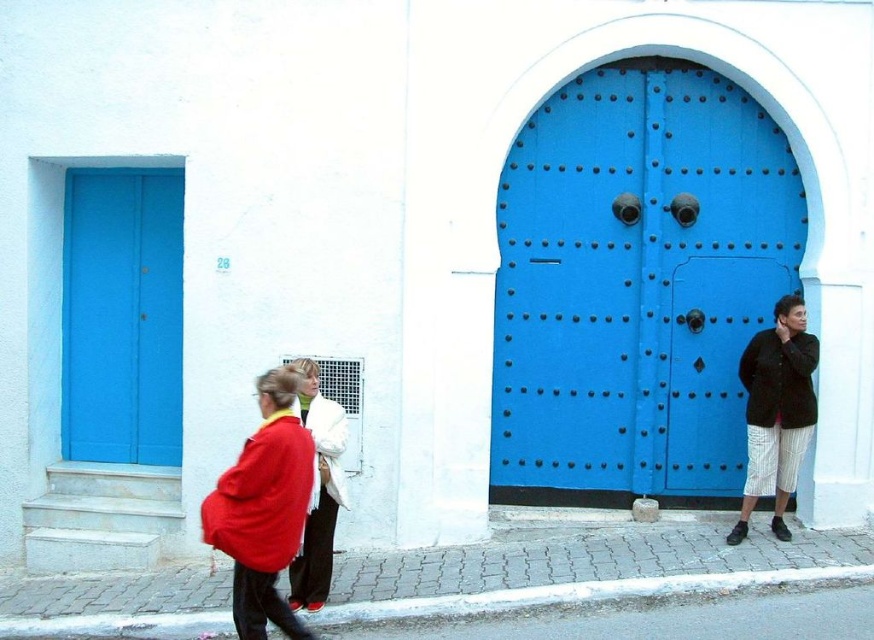
You are a delivery person trying to find apartment number 28. You see the blue painted wood door at center and the matte red sweatshirt at lower left. Which object should you approach first to locate apartment 28?

The blue painted wood door at center should be approached first because the matte red sweatshirt at lower left is behind it, so the door is closer to you.

You are a delivery person trying to distinguish between two customers waiting at the right side of the street. You see the black textured jacket at right and the dark brown cotton sweatshirt at right. Which customer is wearing the larger clothing item?

The black textured jacket at right has a larger size compared to the dark brown cotton sweatshirt at right, so the customer wearing the black textured jacket at right is the one with the larger clothing item.

You are standing at the center of the street and want to enter the blue painted wood door at center. Which direction should you walk to reach it?

The blue painted wood door at center is located at coordinates 0.444 on the x axis and 0.728 on the y axis. Since you are at the center of the street, you should walk towards the direction of the coordinates to reach the door.